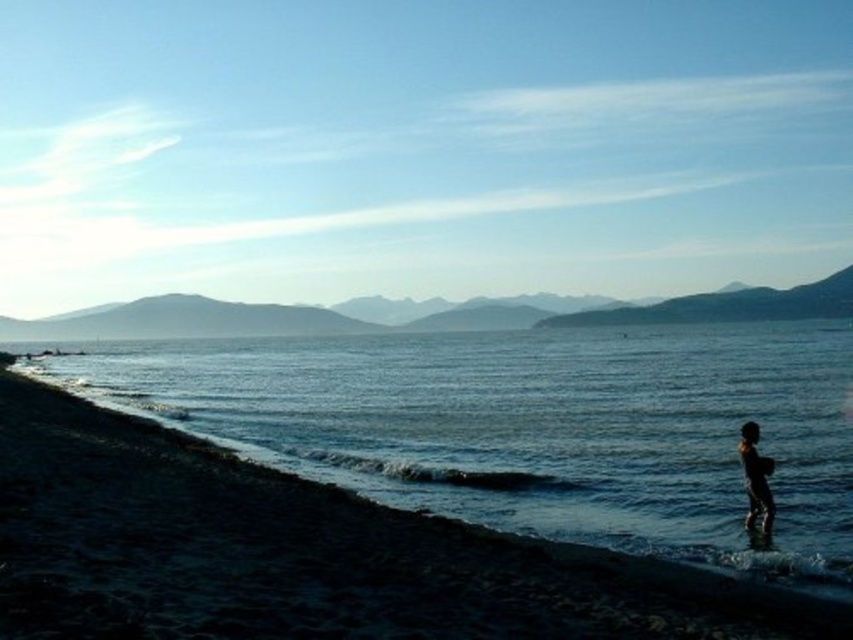
Question: Does dark blue water at lower left have a smaller size compared to dark skin human at lower right?

Choices:
 (A) no
 (B) yes

Answer: (A)

Question: Is dark blue water at lower left wider than dark skin human at lower right?

Choices:
 (A) yes
 (B) no

Answer: (A)

Question: Which object appears farthest from the camera in this image?

Choices:
 (A) dark blue water at lower left
 (B) dark skin human at lower right

Answer: (B)

Question: Which point appears closest to the camera in this image?

Choices:
 (A) (157, 346)
 (B) (769, 512)

Answer: (B)

Question: Which point is farther to the camera?

Choices:
 (A) (756, 512)
 (B) (392, 371)

Answer: (B)

Question: Observing the image, what is the correct spatial positioning of dark blue water at lower left in reference to dark skin human at lower right?

Choices:
 (A) left
 (B) right

Answer: (B)